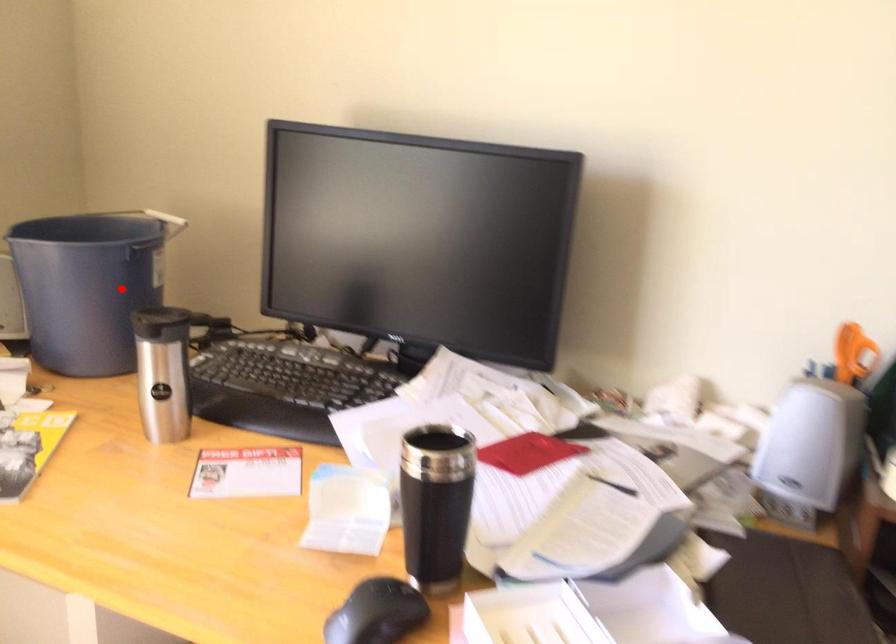
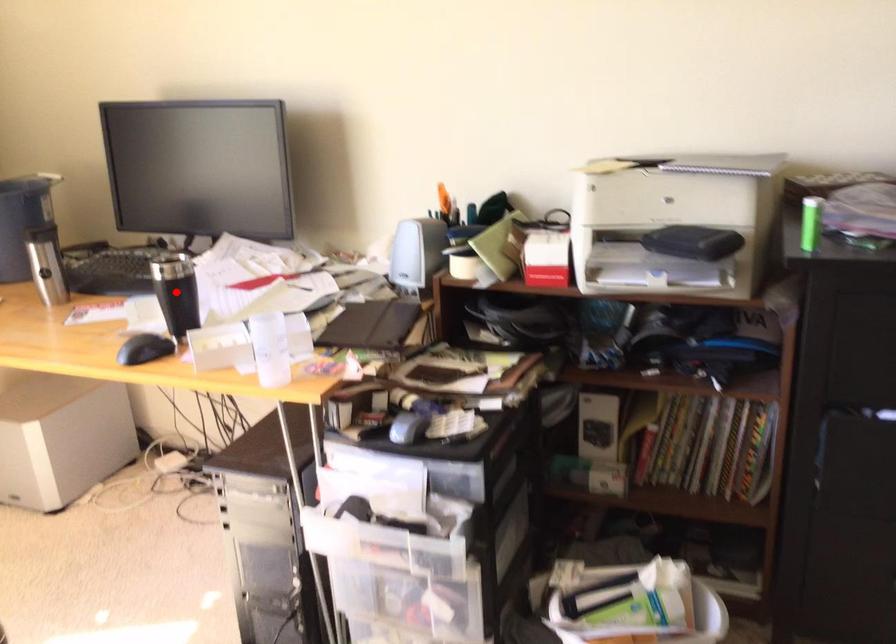
I am providing you with two images of the same scene from different viewpoints. A red point is marked on the first image and another point is marked on the second image. Is the red point in image1 aligned with the point shown in image2?

No